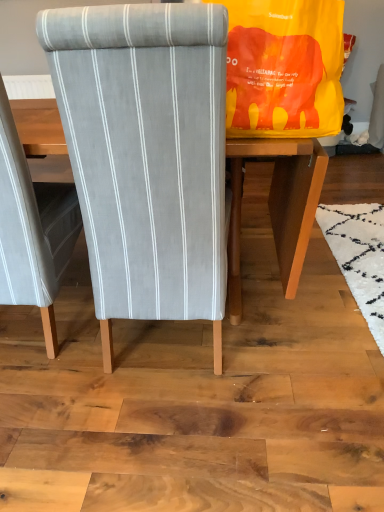
Question: Considering the relative sizes of yellow fabric bag at upper right and textured gray fabric chair at center, placed as the 2th chair when sorted from right to left, in the image provided, is yellow fabric bag at upper right shorter than textured gray fabric chair at center, placed as the 2th chair when sorted from right to left,?

Choices:
 (A) yes
 (B) no

Answer: (A)

Question: From the image's perspective, does yellow fabric bag at upper right appear lower than textured gray fabric chair at center, which is counted as the 1th chair, starting from the left?

Choices:
 (A) yes
 (B) no

Answer: (B)

Question: Could you tell me if yellow fabric bag at upper right is facing textured gray fabric chair at center, which is counted as the 1th chair, starting from the left?

Choices:
 (A) no
 (B) yes

Answer: (B)

Question: Is yellow fabric bag at upper right not close to textured gray fabric chair at center, placed as the 2th chair when sorted from right to left?

Choices:
 (A) yes
 (B) no

Answer: (B)

Question: Considering the relative sizes of yellow fabric bag at upper right and textured gray fabric chair at center, placed as the 2th chair when sorted from right to left, in the image provided, is yellow fabric bag at upper right bigger than textured gray fabric chair at center, placed as the 2th chair when sorted from right to left,?

Choices:
 (A) yes
 (B) no

Answer: (B)

Question: From the image's perspective, is yellow fabric bag at upper right on top of textured gray fabric chair at center, which is counted as the 1th chair, starting from the left?

Choices:
 (A) yes
 (B) no

Answer: (A)

Question: From a real-world perspective, is textured gray fabric chair at center, placed as the 2th chair when sorted from right to left, physically below gray fabric chair at center, the 1th chair from the right?

Choices:
 (A) yes
 (B) no

Answer: (A)

Question: Is textured gray fabric chair at center, placed as the 2th chair when sorted from right to left, far from gray fabric chair at center, the 1th chair from the right?

Choices:
 (A) no
 (B) yes

Answer: (A)

Question: Would you say textured gray fabric chair at center, placed as the 2th chair when sorted from right to left, contains gray fabric chair at center, the 1th chair from the right?

Choices:
 (A) no
 (B) yes

Answer: (A)

Question: Is the depth of textured gray fabric chair at center, which is counted as the 1th chair, starting from the left, less than that of gray fabric chair at center, the 1th chair from the right?

Choices:
 (A) no
 (B) yes

Answer: (A)

Question: Is textured gray fabric chair at center, placed as the 2th chair when sorted from right to left, thinner than gray fabric chair at center, which appears as the second chair when viewed from the left?

Choices:
 (A) yes
 (B) no

Answer: (A)

Question: Considering the relative sizes of textured gray fabric chair at center, which is counted as the 1th chair, starting from the left, and gray fabric chair at center, the 1th chair from the right, in the image provided, is textured gray fabric chair at center, which is counted as the 1th chair, starting from the left, shorter than gray fabric chair at center, the 1th chair from the right,?

Choices:
 (A) yes
 (B) no

Answer: (A)

Question: Considering the relative sizes of yellow fabric bag at upper right and gray fabric chair at center, which appears as the second chair when viewed from the left, in the image provided, is yellow fabric bag at upper right thinner than gray fabric chair at center, which appears as the second chair when viewed from the left,?

Choices:
 (A) no
 (B) yes

Answer: (B)